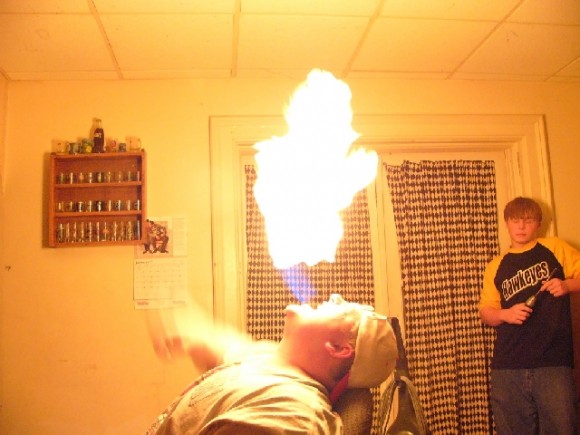
Where is `curtains`? This screenshot has width=580, height=435. curtains is located at coordinates click(442, 218), click(335, 265).